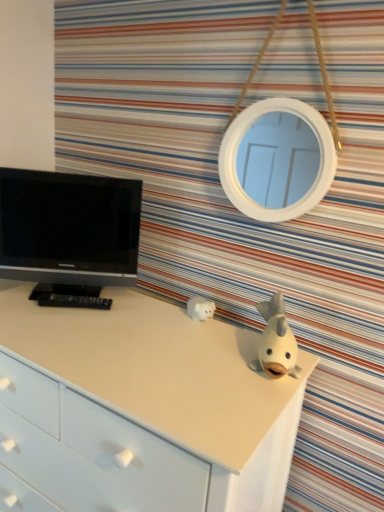
The height and width of the screenshot is (512, 384). In order to click on vacant region to the left of white matte fish at upper right, placed as the 1th toy when sorted from right to left in this screenshot , I will do `click(205, 357)`.